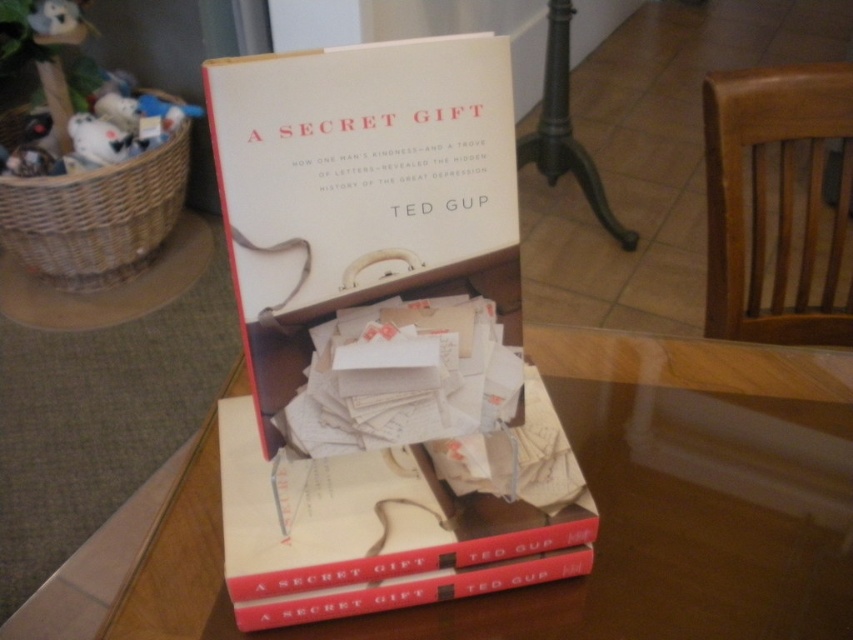
Between point (430, 280) and point (24, 244), which one is positioned behind?

Positioned behind is point (24, 244).

Does matte white book at center appear on the right side of woven brown basket at left?

Correct, you'll find matte white book at center to the right of woven brown basket at left.

Where is `matte white book at center`? matte white book at center is located at coordinates (361, 189).

Locate an element on the screen. Image resolution: width=853 pixels, height=640 pixels. matte white book at center is located at coordinates [x=361, y=189].

Can you confirm if smooth wooden table at center is positioned below matte white book at center?

Indeed, smooth wooden table at center is positioned under matte white book at center.

Can you confirm if smooth wooden table at center is bigger than matte white book at center?

Indeed, smooth wooden table at center has a larger size compared to matte white book at center.

You are a GUI agent. You are given a task and a screenshot of the screen. Output one action in this format:
    pyautogui.click(x=<x>, y=<y>)
    Task: Click on the smooth wooden table at center
    Image resolution: width=853 pixels, height=640 pixels.
    Given the screenshot: What is the action you would take?
    pyautogui.click(x=610, y=508)

Where is `smooth wooden table at center`? The width and height of the screenshot is (853, 640). smooth wooden table at center is located at coordinates (610, 508).

Is the position of smooth wooden table at center more distant than that of woven brown basket at left?

No, it is in front of woven brown basket at left.

Can you confirm if smooth wooden table at center is positioned to the right of woven brown basket at left?

Yes, smooth wooden table at center is to the right of woven brown basket at left.

Find the location of a particular element. This screenshot has width=853, height=640. smooth wooden table at center is located at coordinates (610, 508).

Image resolution: width=853 pixels, height=640 pixels. Identify the location of smooth wooden table at center. (610, 508).